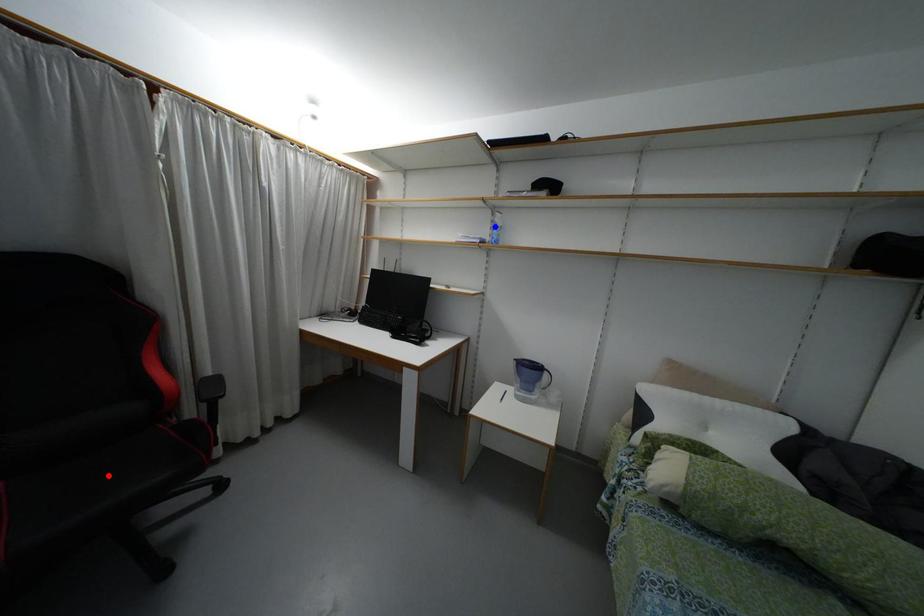
Question: In the image, two points are highlighted. Which point is nearer to the camera? Reply with the corresponding letter.

Choices:
 (A) blue point
 (B) red point

Answer: (B)